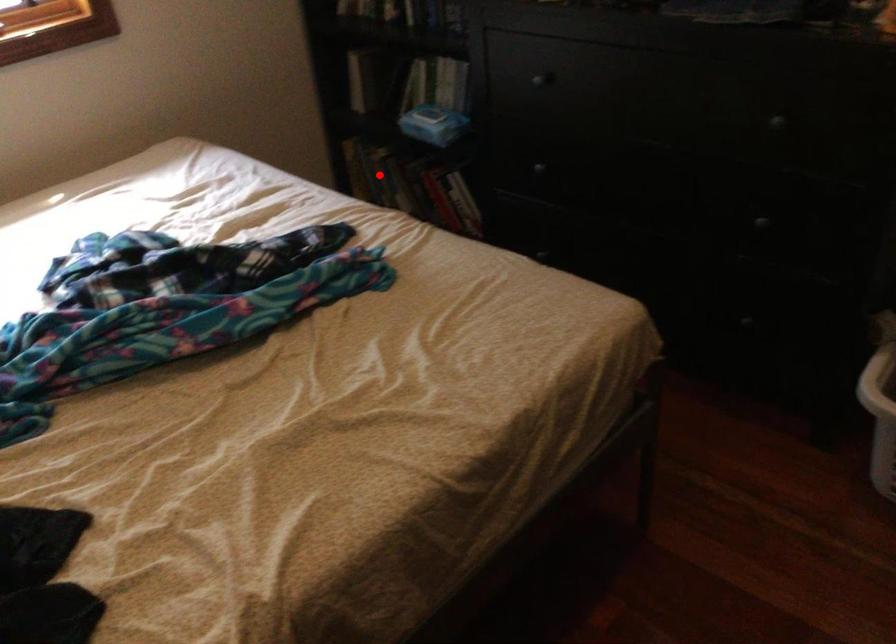
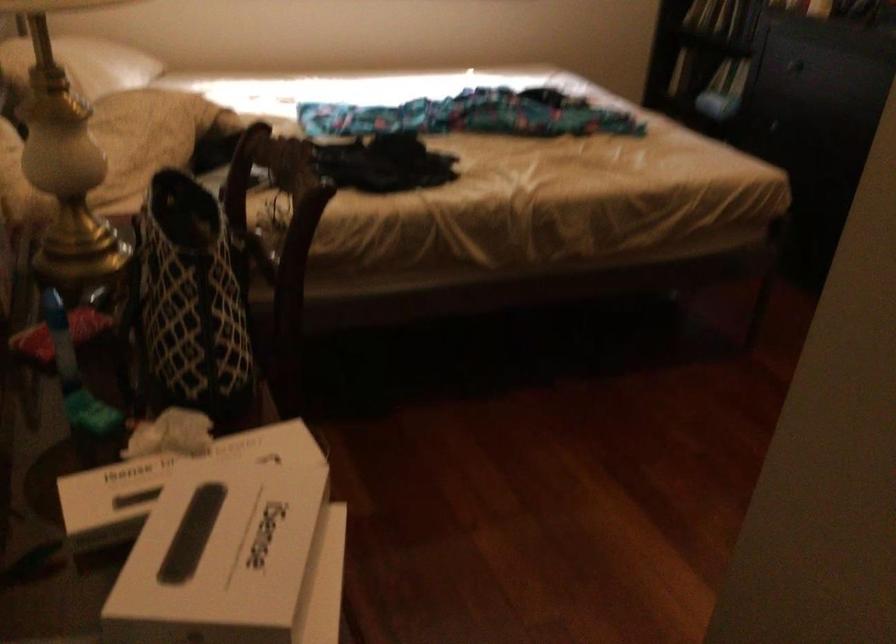
Question: I am providing you with two images of the same scene from different viewpoints. A red point is marked on the first image. At the location where the point appears in image 1, is it still visible in image 2?

Choices:
 (A) Yes
 (B) No

Answer: (B)